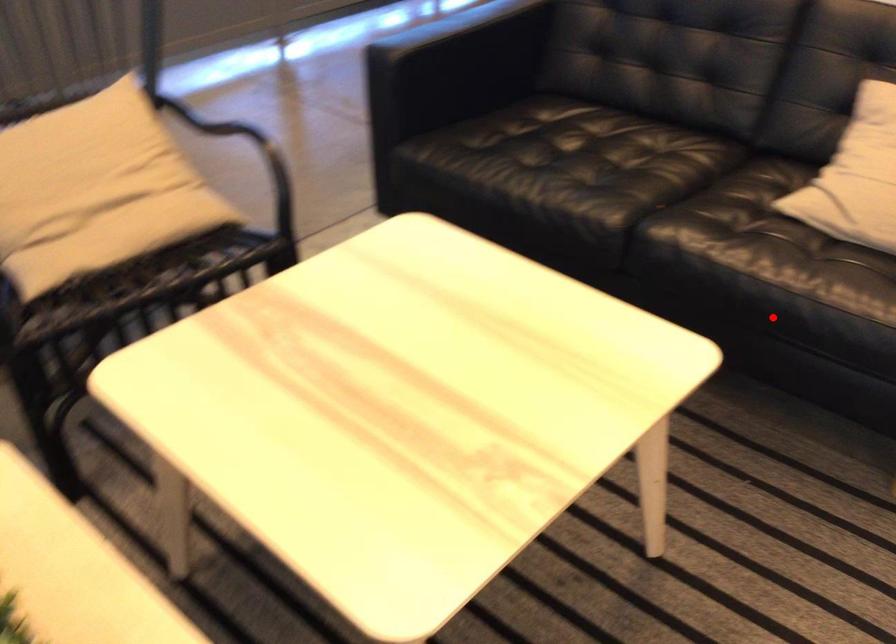
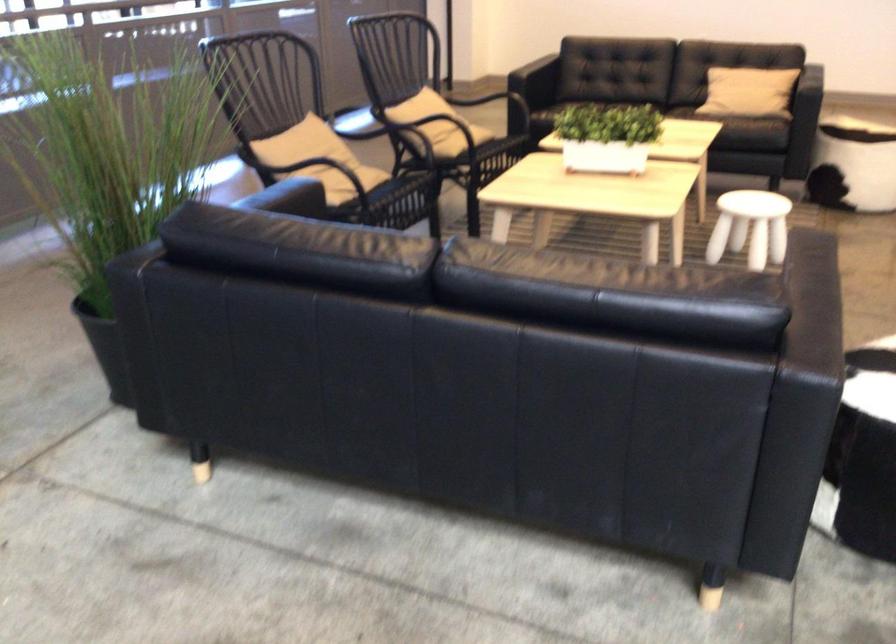
Question: I am providing you with two images of the same scene from different viewpoints. In image1, a red point is highlighted. Considering the same 3D point in image2, which of the following is correct?

Choices:
 (A) It is closer
 (B) It is farther

Answer: (B)